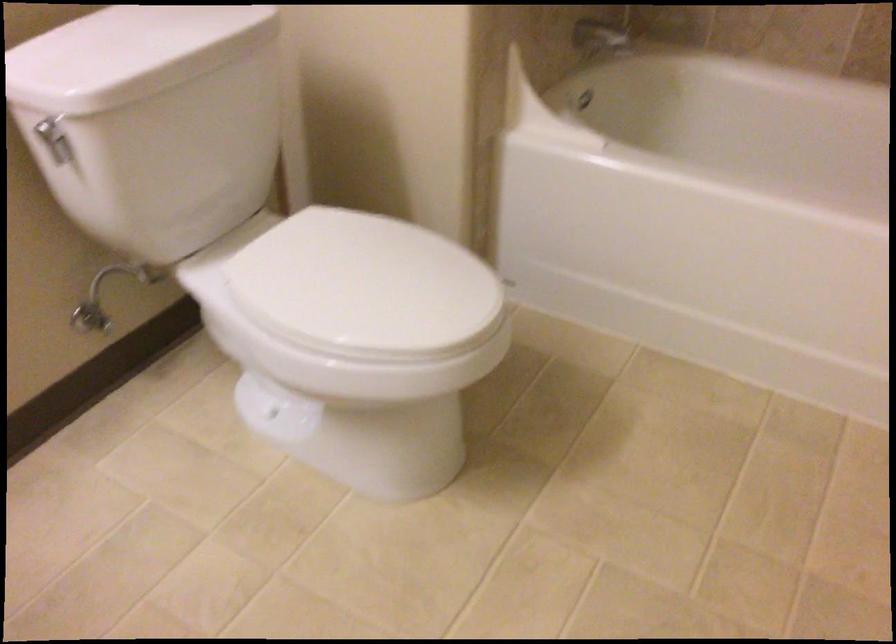
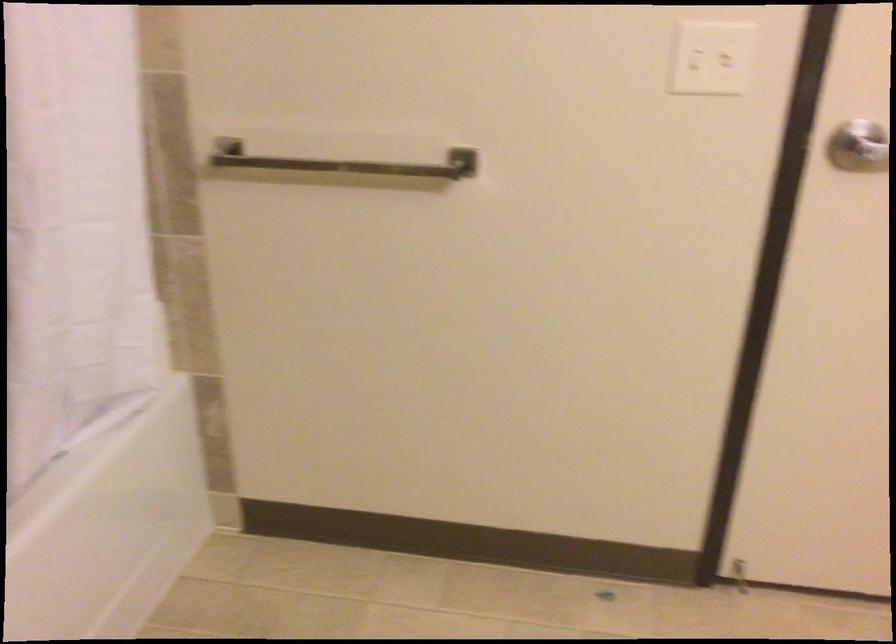
How did the camera likely rotate?

The rotation direction of the camera is right-down.